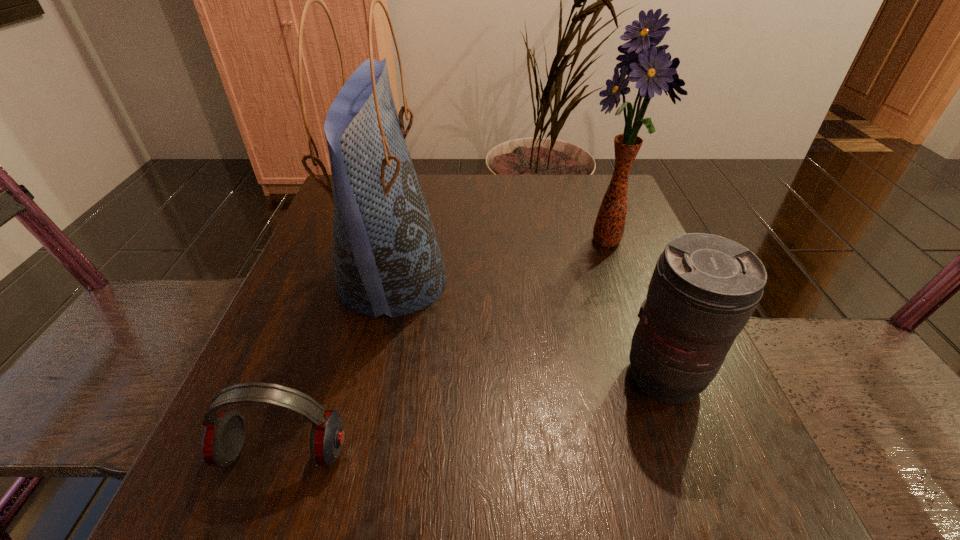
This screenshot has height=540, width=960. What are the coordinates of `vacant region at the right edge of the desktop` in the screenshot? It's located at [x=679, y=454].

The image size is (960, 540). I want to click on vacant area at the far right corner, so click(x=586, y=179).

This screenshot has height=540, width=960. I want to click on free space at the near right corner, so click(x=729, y=490).

The height and width of the screenshot is (540, 960). What are the coordinates of `vacant area that lies between the telephoto lens and the flower arrangement` in the screenshot? It's located at pyautogui.click(x=636, y=309).

Identify the location of empty space between the telephoto lens and the flower arrangement. (636, 309).

Locate an element on the screen. free space between the telephoto lens and the shortest object is located at coordinates (474, 415).

Where is `free space between the shopping bag and the earphone`? free space between the shopping bag and the earphone is located at coordinates (338, 366).

I want to click on free point between the flower arrangement and the third tallest object, so click(636, 309).

Where is `vacant space in between the shopping bag and the telephoto lens`? The image size is (960, 540). vacant space in between the shopping bag and the telephoto lens is located at coordinates [529, 328].

Where is `vacant space that's between the shopping bag and the flower arrangement`? The width and height of the screenshot is (960, 540). vacant space that's between the shopping bag and the flower arrangement is located at coordinates (500, 260).